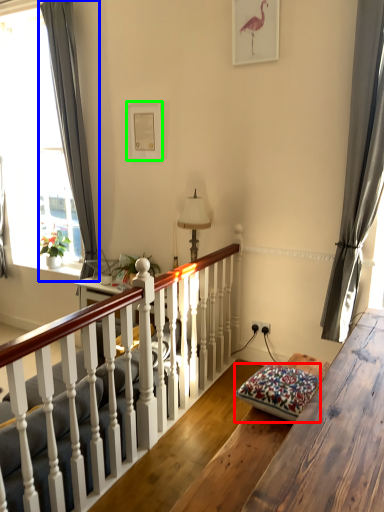
Question: Which object is the closest to the pillow (highlighted by a red box)? Choose among these: curtain (highlighted by a blue box) or picture frame (highlighted by a green box).

Choices:
 (A) curtain
 (B) picture frame

Answer: (B)